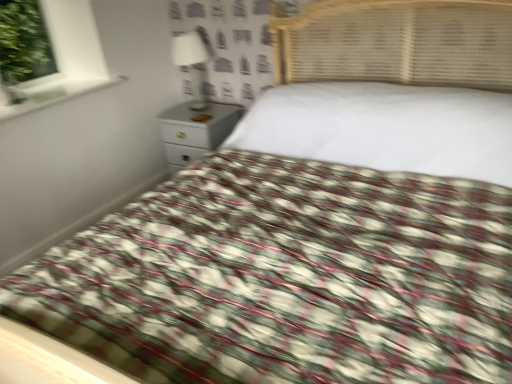
Image resolution: width=512 pixels, height=384 pixels. What are the coordinates of `free space above white glossy window sill at upper left (from a real-world perspective)` in the screenshot? It's located at (50, 92).